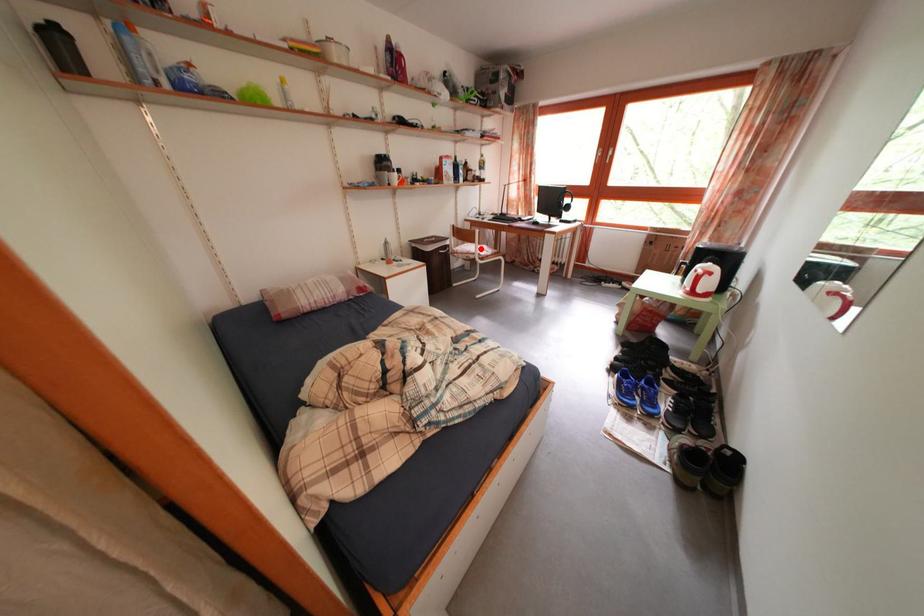
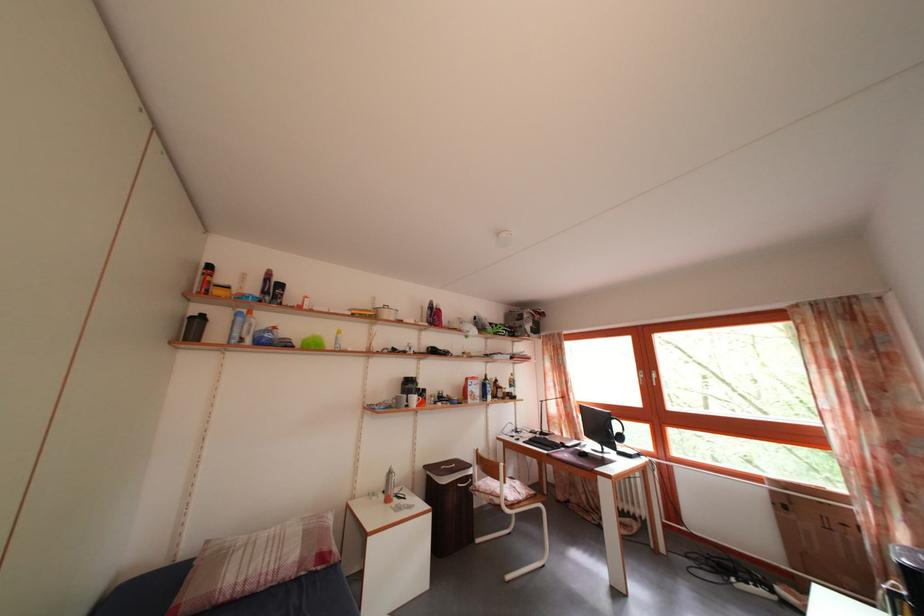
Question: I am providing you with two images of the same scene from different viewpoints. In image1, a red point is highlighted. Considering the same 3D point in image2, which of the following is correct?

Choices:
 (A) It is closer
 (B) It is farther

Answer: (B)